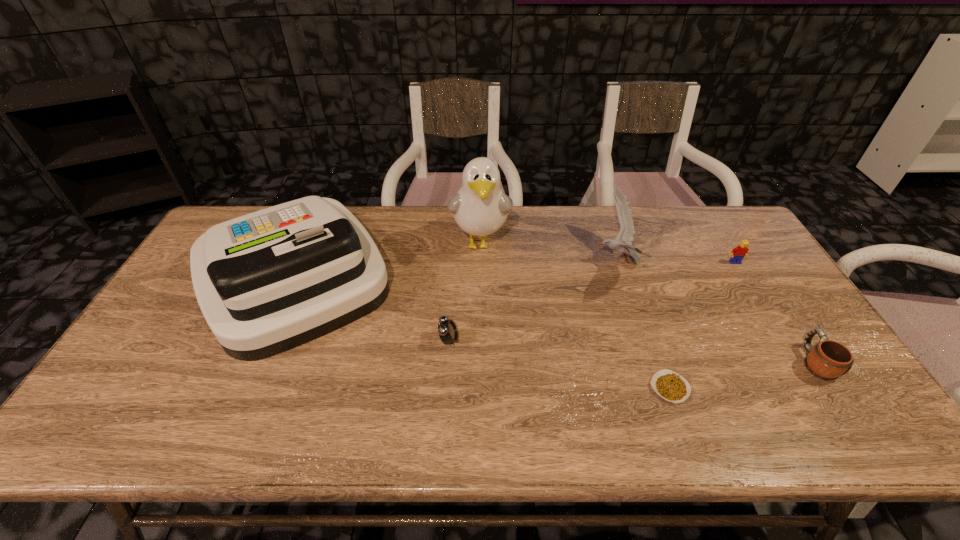
I want to click on vacant space at the near right corner of the desktop, so click(850, 433).

In order to click on unoccupied position between the mug and the sixth shortest object in this screenshot , I will do `click(555, 320)`.

Locate an element on the screen. This screenshot has height=540, width=960. free space between the alarm clock and the legume is located at coordinates (560, 364).

This screenshot has width=960, height=540. Find the location of `free space between the alarm clock and the mug`. free space between the alarm clock and the mug is located at coordinates (632, 351).

Where is `blank region between the leftmost object and the shortest object`? This screenshot has height=540, width=960. blank region between the leftmost object and the shortest object is located at coordinates (482, 333).

The image size is (960, 540). In order to click on free space between the tallest object and the leftmost object in this screenshot , I will do `click(387, 260)`.

You are a GUI agent. You are given a task and a screenshot of the screen. Output one action in this format:
    pyautogui.click(x=<x>, y=<y>)
    Task: Click on the free spot between the right gull and the mug
    Image resolution: width=960 pixels, height=540 pixels.
    Given the screenshot: What is the action you would take?
    pyautogui.click(x=716, y=312)

The height and width of the screenshot is (540, 960). I want to click on unoccupied area between the legume and the sixth shortest object, so 482,333.

Find the location of a particular element. This screenshot has height=540, width=960. blank region between the right gull and the second tallest object is located at coordinates (456, 270).

Where is `vacant area that lies between the right gull and the alarm clock`? The image size is (960, 540). vacant area that lies between the right gull and the alarm clock is located at coordinates (533, 301).